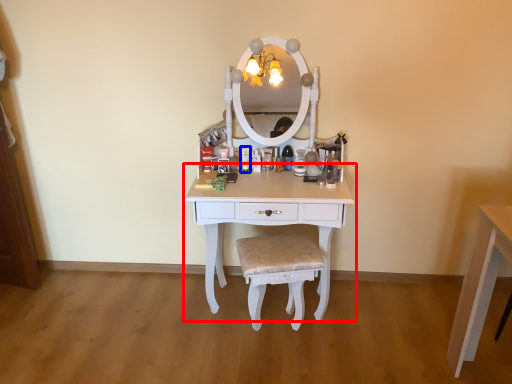
Question: Which object is further to the camera taking this photo, table (highlighted by a red box) or toiletry (highlighted by a blue box)?

Choices:
 (A) table
 (B) toiletry

Answer: (B)